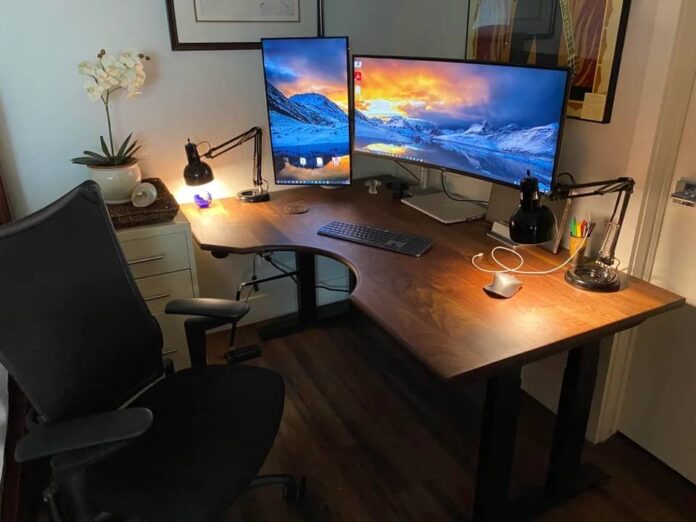
Image resolution: width=696 pixels, height=522 pixels. I want to click on clock, so click(147, 191).